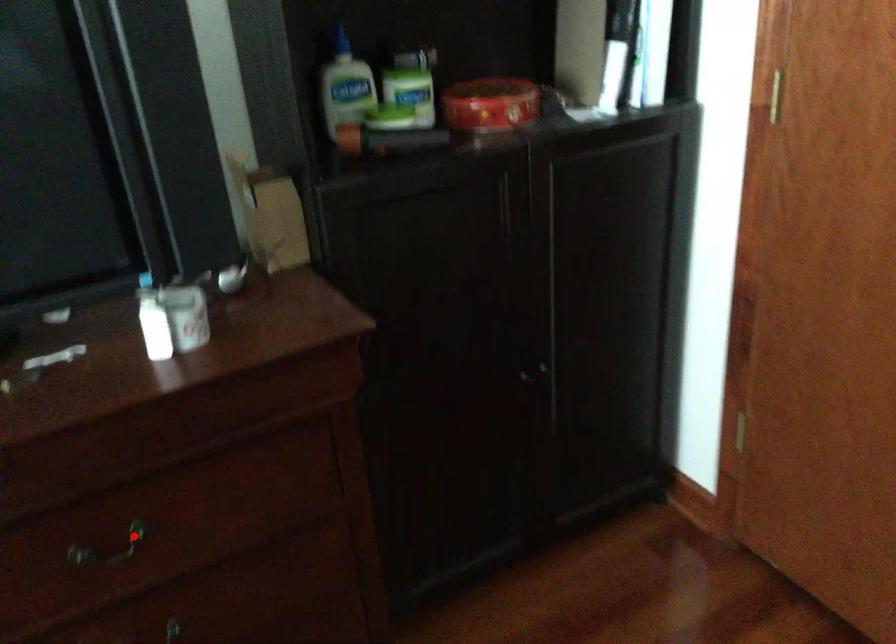
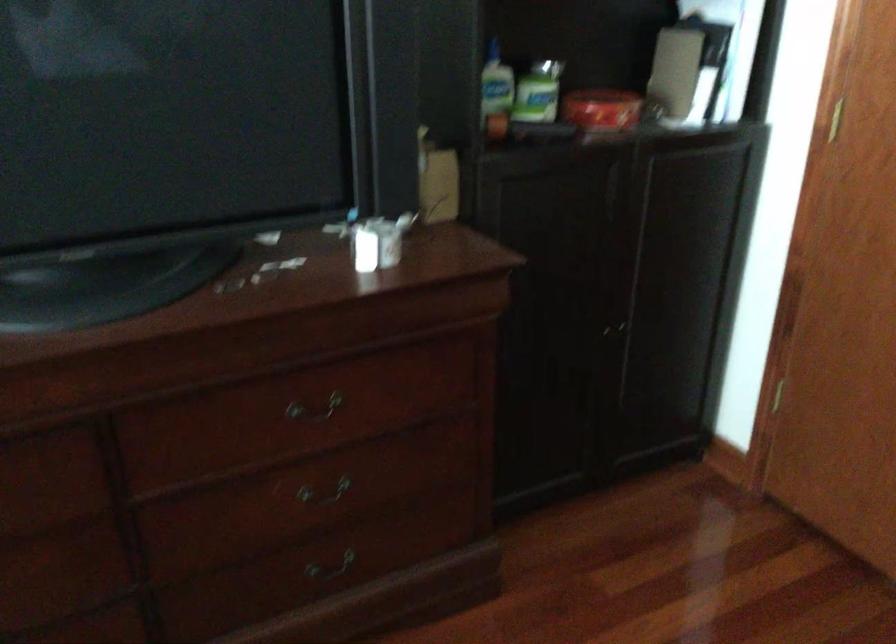
Question: I am providing you with two images of the same scene from different viewpoints. Given a red point in image1, look at the same physical point in image2. Is it:

Choices:
 (A) Closer to the viewpoint
 (B) Farther from the viewpoint

Answer: (B)